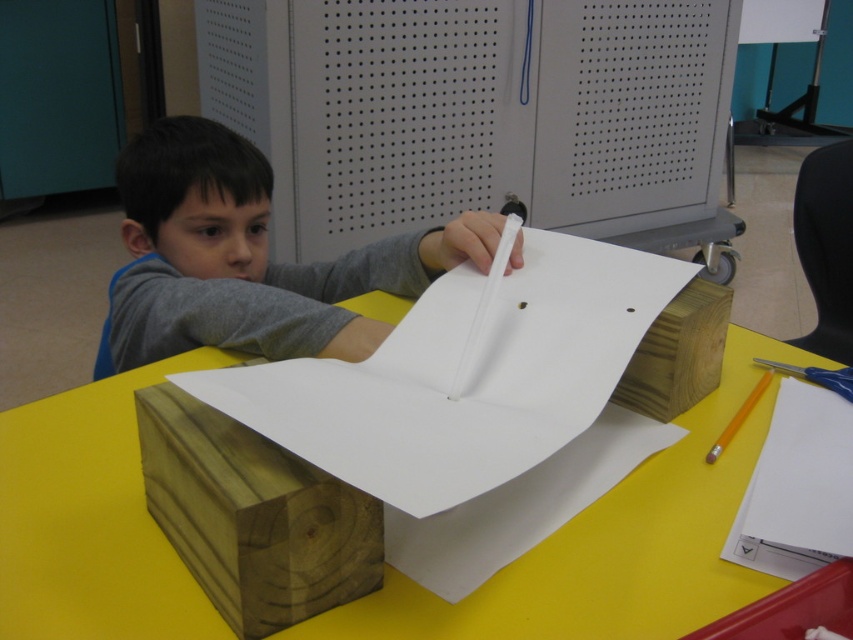
The boy is trying to place the yellow matte pencil at center on top of the white paper at center. Will the pencil fit entirely on the paper without hanging off the edges?

The white paper at center is wider than the yellow matte pencil at center, so the pencil will fit entirely on the paper without hanging off the edges.

You are a parent observing your child at a crafting table. You notice two points on the table where the boy is working. The first point is at coordinates point (x=467, y=68) and the second is at point (x=735, y=419). Which point is closer to you?

Point (x=467, y=68) is closer to you because it is further to the viewer than point (x=735, y=419).

You are a student trying to decide where to place your new backpack. You have two options on the image provided. Which object, the gray perforated locker at upper center or the gray matte shirt at upper left, is taller and would provide more vertical storage space?

The gray perforated locker at upper center has a greater height compared to the gray matte shirt at upper left, so it would provide more vertical storage space.